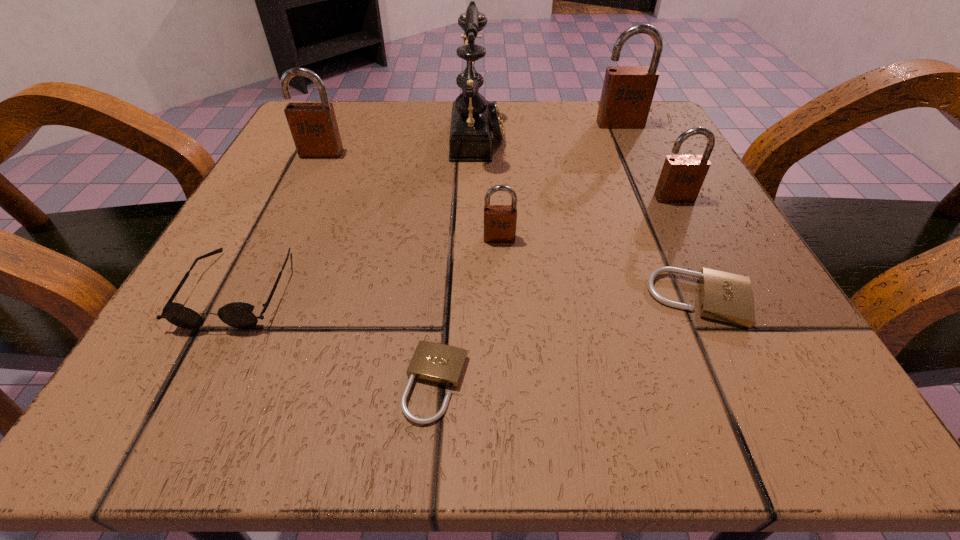
Locate an element on the screen. This screenshot has width=960, height=540. blank space at the left edge of the desktop is located at coordinates (296, 229).

Locate an element on the screen. Image resolution: width=960 pixels, height=540 pixels. vacant space at the right edge of the desktop is located at coordinates (672, 334).

I want to click on vacant region at the far left corner of the desktop, so click(x=356, y=147).

You are a GUI agent. You are given a task and a screenshot of the screen. Output one action in this format:
    pyautogui.click(x=<x>, y=<y>)
    Task: Click on the free space at the near left corner
    Image resolution: width=960 pixels, height=540 pixels.
    Given the screenshot: What is the action you would take?
    pyautogui.click(x=254, y=410)

In the image, there is a desktop. Identify the location of vacant space at the far right corner. (627, 146).

Where is `vacant area at the near right corner`? The width and height of the screenshot is (960, 540). vacant area at the near right corner is located at coordinates (683, 385).

The image size is (960, 540). Find the location of `unoccupied position between the black telephone and the third brown padlock from right to left`. unoccupied position between the black telephone and the third brown padlock from right to left is located at coordinates (489, 187).

Identify the location of free area in between the seventh shortest object and the fourth shortest padlock. The image size is (960, 540). 647,161.

The image size is (960, 540). I want to click on empty space that is in between the fifth shortest object and the leftmost padlock, so click(498, 176).

In order to click on unoccupied position between the black telephone and the leftmost padlock in this screenshot , I will do `click(399, 144)`.